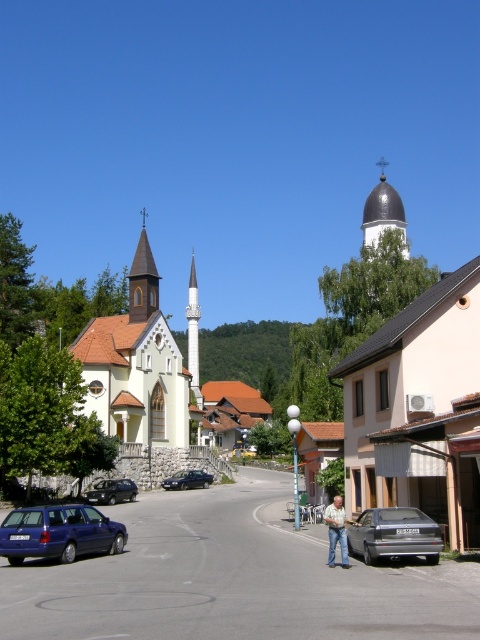
Question: Which point is closer to the camera?

Choices:
 (A) white matte church at left
 (B) white marble minaret at center
 (C) matte black car at center-left
 (D) jeans at center

Answer: (D)

Question: Does metallic blue station wagon at lower left have a greater width compared to jeans at center?

Choices:
 (A) no
 (B) yes

Answer: (B)

Question: From the image, what is the correct spatial relationship of white matte church at left in relation to dark blue metallic sedan at center?

Choices:
 (A) below
 (B) above

Answer: (B)

Question: Considering the real-world distances, which object is closest to the brown wooden spire at upper left?

Choices:
 (A) shiny dark gray dome at center
 (B) dark blue metallic sedan at center

Answer: (B)

Question: Which object is positioned closest to the silver metallic sedan at center?

Choices:
 (A) shiny dark gray dome at center
 (B) brown wooden spire at upper left

Answer: (A)

Question: Is white matte church at left positioned in front of metallic blue station wagon at lower left?

Choices:
 (A) no
 (B) yes

Answer: (A)